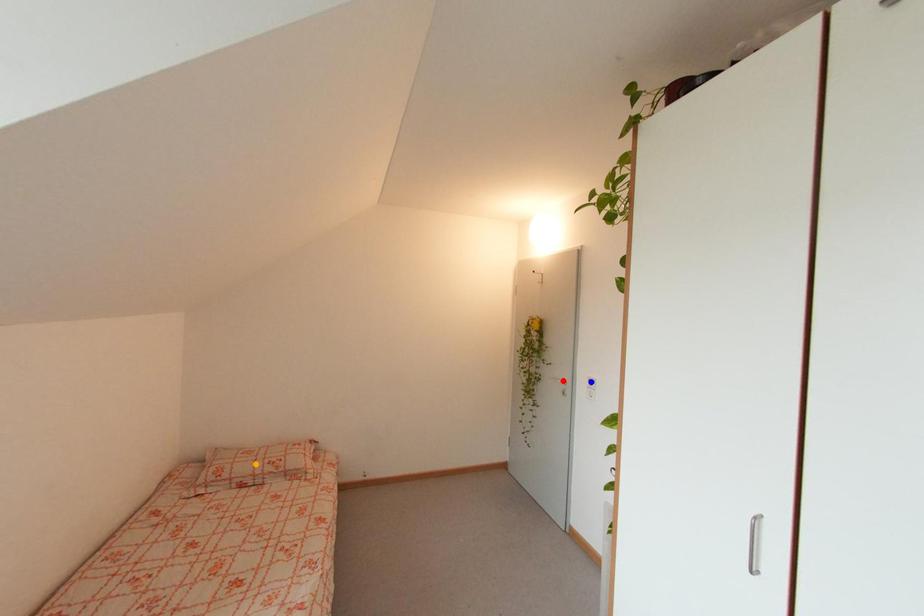
Order these from nearest to farthest:
1. orange point
2. blue point
3. red point

red point
blue point
orange point